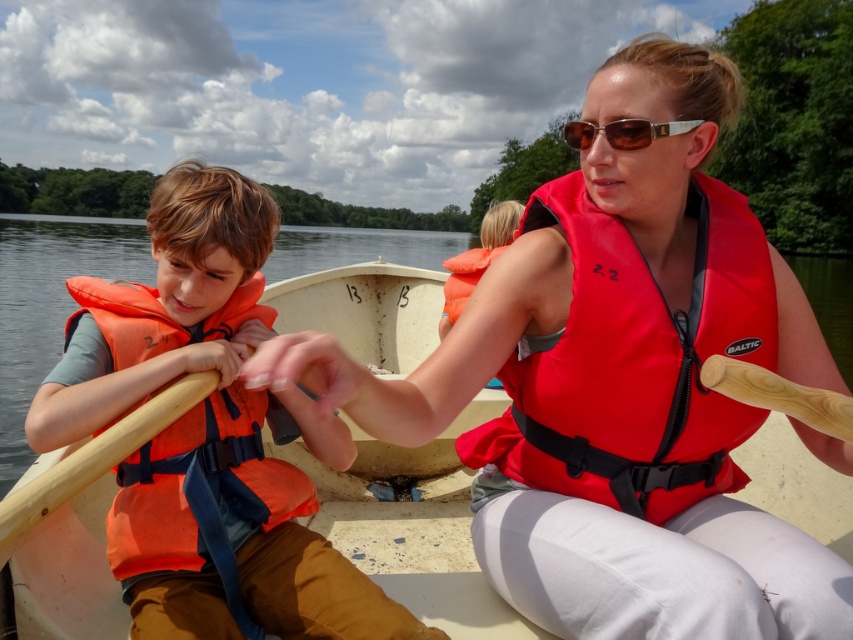
From the picture: You are a photographer trying to capture the brown metallic sunglasses at center in the image. The sunglasses are located at point (624, 132). If you look to the right of this point, what object do you see?

To the right of point (624, 132), you will find the woman wearing a red life vest labeled Baltic and white pants, who is seated in a lightcolored canoe holding a wooden paddle in her right hand.

You are a lifeguard observing the scene. You notice two life jackets at the center of the canoe. Which one is nearer to you, the red nylon life jacket at center or the orange fabric life jacket at center?

The red nylon life jacket at center is closer to the viewer than the orange fabric life jacket at center.